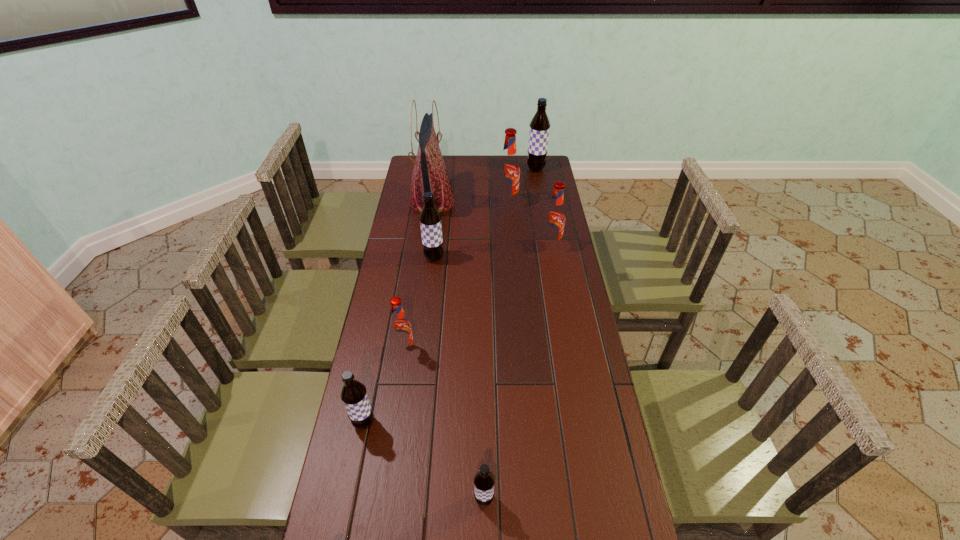
You are a GUI agent. You are given a task and a screenshot of the screen. Output one action in this format:
    pyautogui.click(x=<x>, y=<y>)
    Task: Click on the handbag
    The height and width of the screenshot is (540, 960).
    Given the screenshot: What is the action you would take?
    pyautogui.click(x=430, y=174)

Find the location of a particular element. This screenshot has height=540, width=960. the farthest red root beer is located at coordinates (508, 175).

You are a GUI agent. You are given a task and a screenshot of the screen. Output one action in this format:
    pyautogui.click(x=<x>, y=<y>)
    Task: Click on the fifth root beer from left to right
    Image resolution: width=960 pixels, height=540 pixels.
    Given the screenshot: What is the action you would take?
    pyautogui.click(x=508, y=175)

Locate an element on the screen. The image size is (960, 540). the farthest brown root beer is located at coordinates pos(539,130).

This screenshot has height=540, width=960. Find the location of `the farthest object`. the farthest object is located at coordinates (539, 130).

Locate an element on the screen. Image resolution: width=960 pixels, height=540 pixels. the rightmost red root beer is located at coordinates (554, 220).

Locate an element on the screen. This screenshot has width=960, height=540. the second biggest red root beer is located at coordinates (554, 220).

The width and height of the screenshot is (960, 540). Find the location of `the second biggest brown root beer`. the second biggest brown root beer is located at coordinates (430, 219).

Identify the location of the third nearest brown root beer. (430, 219).

This screenshot has width=960, height=540. I want to click on the third nearest object, so click(400, 327).